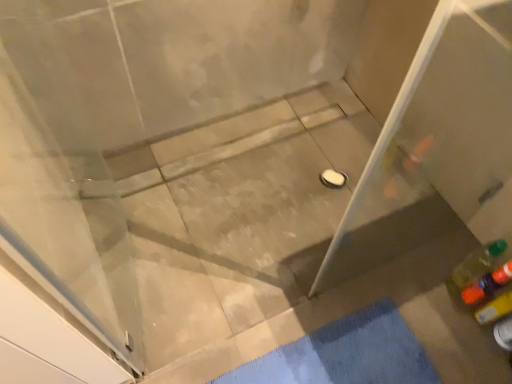
In order to click on translucent plastic bottle at lower right in this screenshot , I will do `click(487, 284)`.

This screenshot has height=384, width=512. What do you see at coordinates (487, 284) in the screenshot?
I see `translucent plastic bottle at lower right` at bounding box center [487, 284].

Find the location of `translucent plastic bottle at lower right`. translucent plastic bottle at lower right is located at coordinates (487, 284).